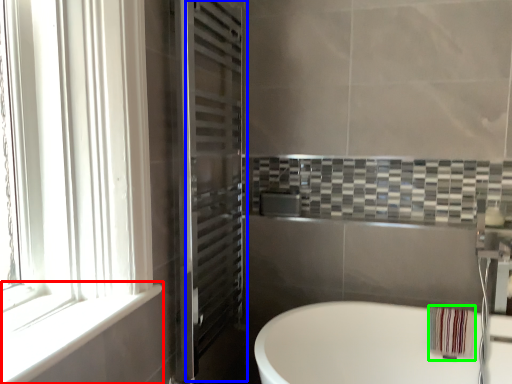
Question: Which object is positioned farthest from window sill (highlighted by a red box)? Select from screen door (highlighted by a blue box) and material (highlighted by a green box).

Choices:
 (A) screen door
 (B) material

Answer: (B)